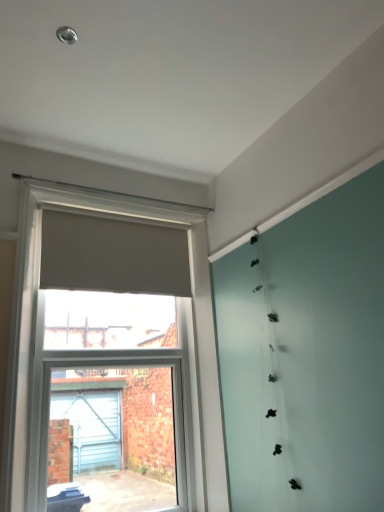
Question: From a real-world perspective, is matte gray roller blind at left positioned above or below matte beige curtain at upper center?

Choices:
 (A) above
 (B) below

Answer: (B)

Question: Choose the correct answer: Is matte gray roller blind at left inside matte beige curtain at upper center or outside it?

Choices:
 (A) inside
 (B) outside

Answer: (B)

Question: In terms of height, does matte gray roller blind at left look taller or shorter compared to matte beige curtain at upper center?

Choices:
 (A) tall
 (B) short

Answer: (A)

Question: Is point (51, 244) closer or farther from the camera than point (190, 248)?

Choices:
 (A) closer
 (B) farther

Answer: (A)

Question: Considering the positions of matte beige curtain at upper center and matte gray roller blind at left in the image, is matte beige curtain at upper center bigger or smaller than matte gray roller blind at left?

Choices:
 (A) small
 (B) big

Answer: (A)

Question: In terms of width, does matte beige curtain at upper center look wider or thinner when compared to matte gray roller blind at left?

Choices:
 (A) thin
 (B) wide

Answer: (A)

Question: From the image's perspective, is matte beige curtain at upper center positioned above or below matte gray roller blind at left?

Choices:
 (A) above
 (B) below

Answer: (A)